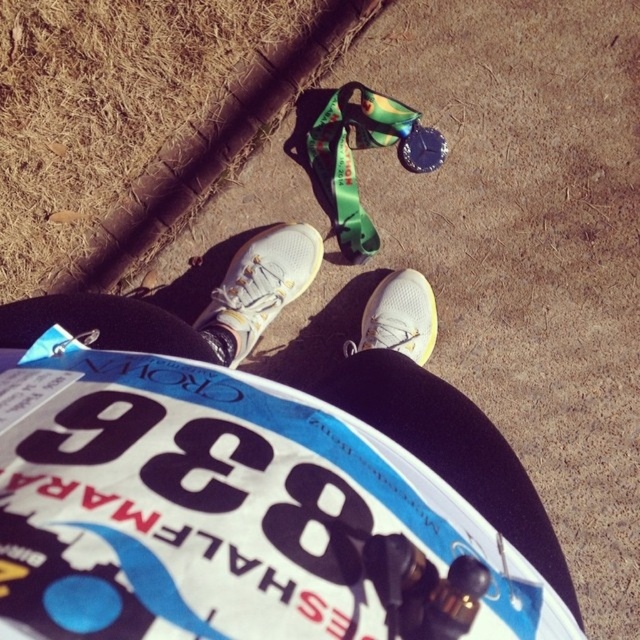
Question: Is the position of white fabric shoe at center more distant than that of white mesh shoe at center?

Choices:
 (A) no
 (B) yes

Answer: (A)

Question: Which point appears farthest from the camera in this image?

Choices:
 (A) (428, 308)
 (B) (236, 284)

Answer: (A)

Question: Does white fabric shoe at center come in front of white mesh shoe at center?

Choices:
 (A) no
 (B) yes

Answer: (B)

Question: Does white fabric shoe at center have a lesser width compared to white mesh shoe at center?

Choices:
 (A) no
 (B) yes

Answer: (A)